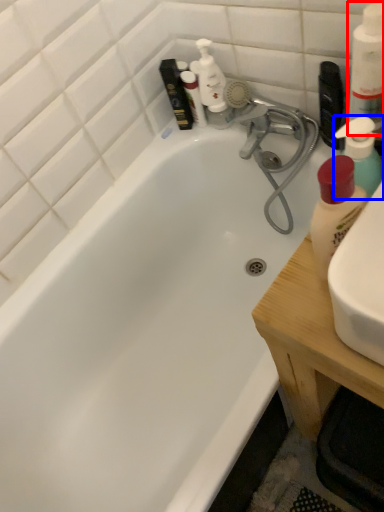
Question: Which point is further to the camera, cleaning product (highlighted by a red box) or cleaning product (highlighted by a blue box)?

Choices:
 (A) cleaning product
 (B) cleaning product

Answer: (B)